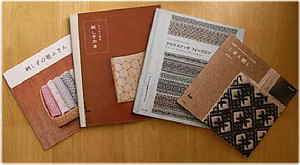
Where is `table`? Image resolution: width=300 pixels, height=165 pixels. table is located at coordinates (56, 31).